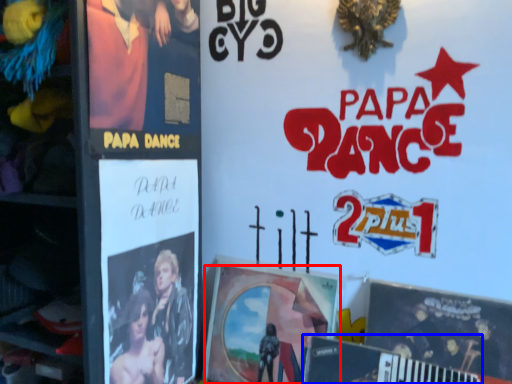
Question: Which of the following is the farthest to the observer, poster (highlighted by a red box) or magazine (highlighted by a blue box)?

Choices:
 (A) poster
 (B) magazine

Answer: (A)